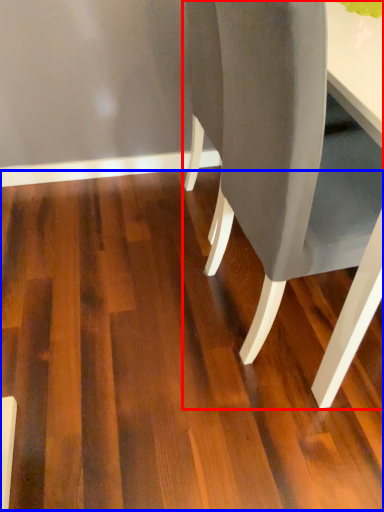
Question: Which of the following is the closest to the observer, chair (highlighted by a red box) or plywood (highlighted by a blue box)?

Choices:
 (A) chair
 (B) plywood

Answer: (A)